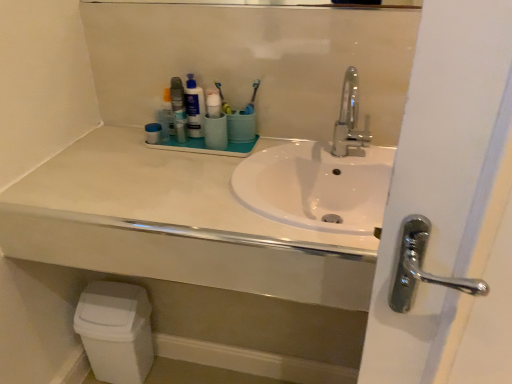
Question: Considering the relative sizes of matte plastic mouthwash at center and polished chrome faucet at center in the image provided, is matte plastic mouthwash at center smaller than polished chrome faucet at center?

Choices:
 (A) yes
 (B) no

Answer: (A)

Question: From the image's perspective, is matte plastic mouthwash at center located beneath polished chrome faucet at center?

Choices:
 (A) no
 (B) yes

Answer: (A)

Question: Is matte plastic mouthwash at center oriented towards polished chrome faucet at center?

Choices:
 (A) no
 (B) yes

Answer: (A)

Question: From a real-world perspective, is matte plastic mouthwash at center positioned over polished chrome faucet at center based on gravity?

Choices:
 (A) no
 (B) yes

Answer: (A)

Question: From the image's perspective, is matte plastic mouthwash at center located above polished chrome faucet at center?

Choices:
 (A) no
 (B) yes

Answer: (B)

Question: Is matte plastic container at upper center, which is the 1th toiletry in left-to-right order, bigger or smaller than matte plastic mouthwash at center?

Choices:
 (A) big
 (B) small

Answer: (B)

Question: In the image, is matte plastic container at upper center, which is the 1th toiletry in left-to-right order, positioned in front of or behind matte plastic mouthwash at center?

Choices:
 (A) behind
 (B) front

Answer: (A)

Question: Is matte plastic container at upper center, which is the 1th toiletry in left-to-right order, wider or thinner than matte plastic mouthwash at center?

Choices:
 (A) wide
 (B) thin

Answer: (B)

Question: From the image's perspective, is matte plastic container at upper center, which is the 1th toiletry in left-to-right order, located above or below matte plastic mouthwash at center?

Choices:
 (A) above
 (B) below

Answer: (B)

Question: From the image's perspective, is white matte countertop at center above or below blue glossy lotion at center?

Choices:
 (A) below
 (B) above

Answer: (A)

Question: Is white matte countertop at center taller or shorter than blue glossy lotion at center?

Choices:
 (A) short
 (B) tall

Answer: (A)

Question: Is white matte countertop at center wider or thinner than blue glossy lotion at center?

Choices:
 (A) thin
 (B) wide

Answer: (B)

Question: From a real-world perspective, relative to blue glossy lotion at center, is white matte countertop at center vertically above or below?

Choices:
 (A) above
 (B) below

Answer: (B)

Question: Is white matte countertop at center taller or shorter than white plastic toothbrush at center, the first toothbrush in the left-to-right sequence?

Choices:
 (A) tall
 (B) short

Answer: (A)

Question: Looking at the image, does white matte countertop at center seem bigger or smaller compared to white plastic toothbrush at center, the first toothbrush in the left-to-right sequence?

Choices:
 (A) small
 (B) big

Answer: (B)